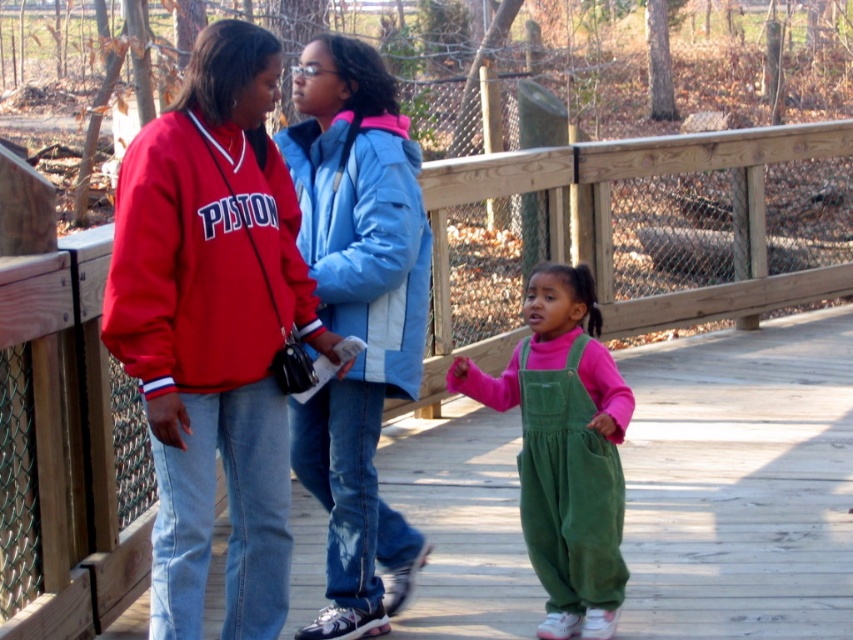
You are standing on the wooden bridge and see the light blue jacket at center. Where exactly is it located relative to the point marked at coordinates (357, 317)?

The light blue jacket at center is exactly at the point marked at coordinates (357, 317).